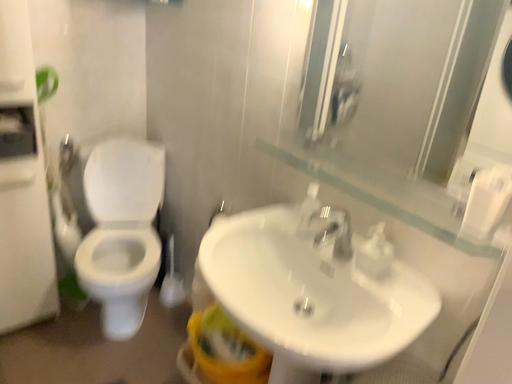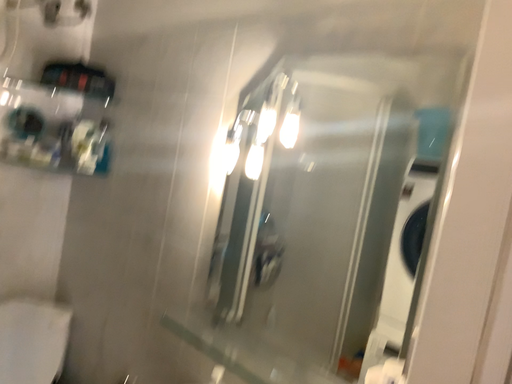
Question: How did the camera likely rotate when shooting the video?

Choices:
 (A) rotated downward
 (B) rotated upward

Answer: (B)